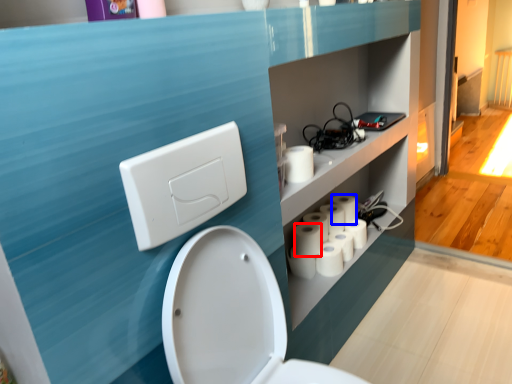
Question: Which object is closer to the camera taking this photo, toilet paper (highlighted by a red box) or toilet paper (highlighted by a blue box)?

Choices:
 (A) toilet paper
 (B) toilet paper

Answer: (A)